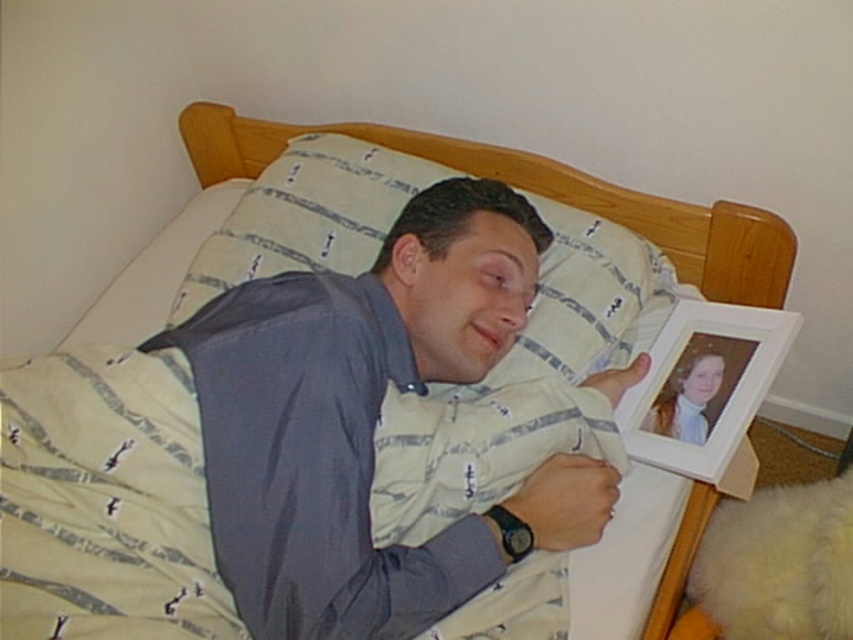
You are a delivery robot in the room. You need to move from the starting point at point (314,152) to the delivery point at point (659,445). Is the delivery point in front of or behind you?

The delivery point at point (659,445) is in front of you because point (314,152) is behind point (659,445).